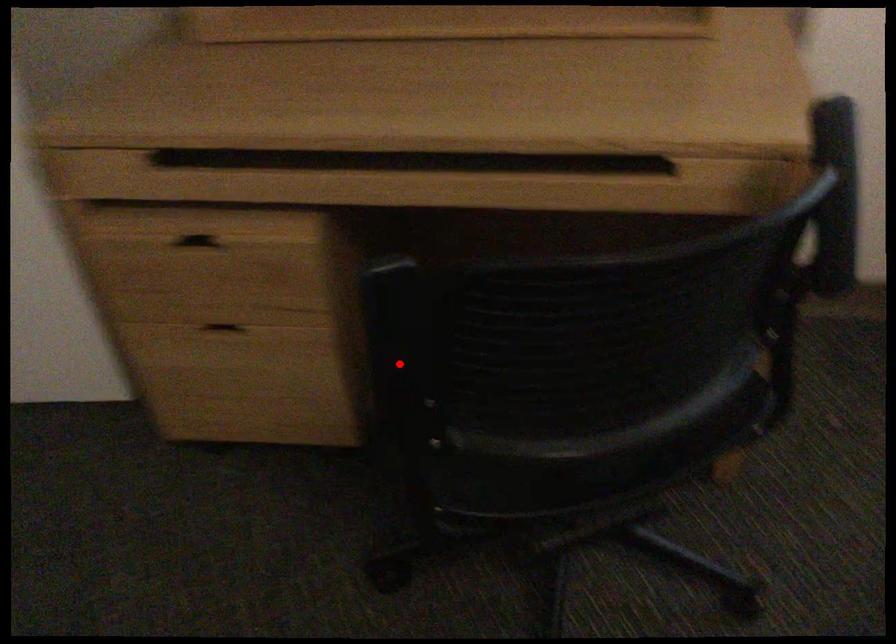
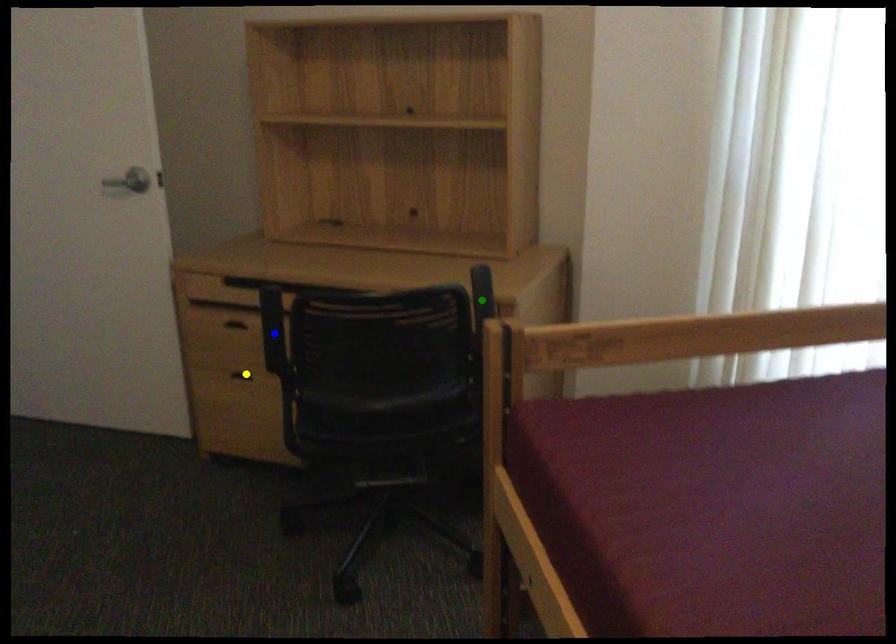
Question: I am providing you with two images of the same scene from different viewpoints. A red point is marked on the first image. You are given multiple points on the second image. Which point in image 2 is actually the same real-world point as the red point in image 1?

Choices:
 (A) blue point
 (B) green point
 (C) yellow point

Answer: (A)